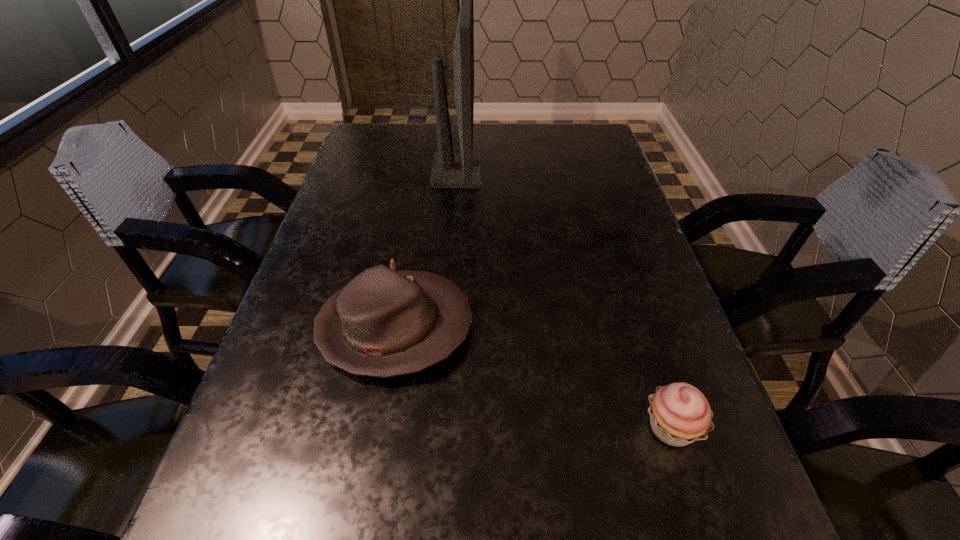
Identify the location of object present at the right edge. The image size is (960, 540). (680, 414).

What are the coordinates of `vacant position at the far edge of the desktop` in the screenshot? It's located at (503, 145).

This screenshot has height=540, width=960. In order to click on vacant space at the left edge of the desktop in this screenshot , I will do `click(333, 254)`.

Identify the location of vacant region at the right edge. The image size is (960, 540). (609, 265).

Where is `free space at the far right corner of the desktop`? This screenshot has height=540, width=960. free space at the far right corner of the desktop is located at coordinates (573, 158).

The image size is (960, 540). In order to click on free spot between the farthest object and the cupcake in this screenshot , I will do `click(564, 300)`.

In order to click on vacant region between the second farthest object and the rightmost object in this screenshot , I will do `click(533, 377)`.

Identify the location of vacant area that lies between the rightmost object and the tallest object. The width and height of the screenshot is (960, 540). (564, 300).

Identify the location of free space between the tallest object and the rightmost object. This screenshot has height=540, width=960. (564, 300).

Find the location of a particular element. vacant area that lies between the cupcake and the hat is located at coordinates (533, 377).